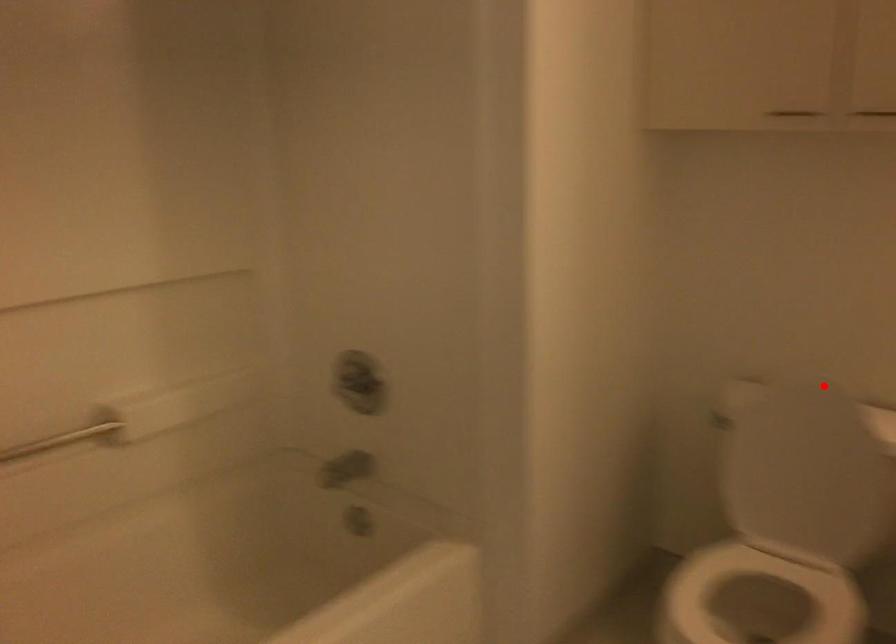
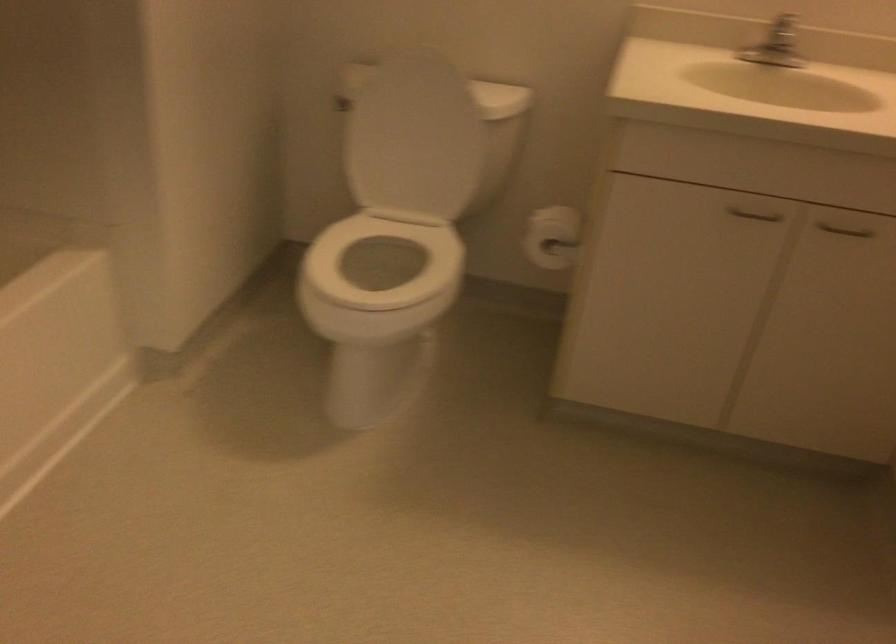
Where in the second image is the point corresponding to the highlighted location from the first image?

(440, 61)